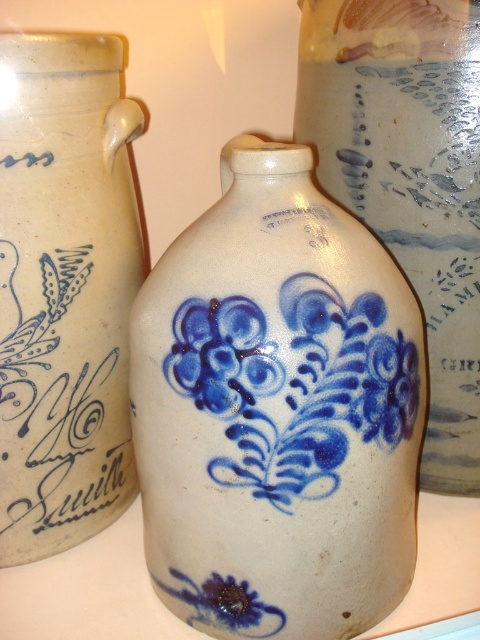
Question: Can you confirm if white stoneware vase at center is positioned below matte ceramic vase at left?

Choices:
 (A) yes
 (B) no

Answer: (A)

Question: Can you confirm if matte ceramic vase at left is smaller than blue painted floral design at center?

Choices:
 (A) yes
 (B) no

Answer: (B)

Question: Which point is farther from the camera taking this photo?

Choices:
 (A) (117, 356)
 (B) (273, 413)

Answer: (A)

Question: Which of the following is the closest to the observer?

Choices:
 (A) (109, 220)
 (B) (227, 376)
 (C) (396, 428)

Answer: (B)

Question: Is matte ceramic vase at left smaller than blue painted floral design at center?

Choices:
 (A) yes
 (B) no

Answer: (B)

Question: Which of the following is the farthest from the observer?

Choices:
 (A) (334, 13)
 (B) (297, 468)
 (C) (48, 177)

Answer: (A)